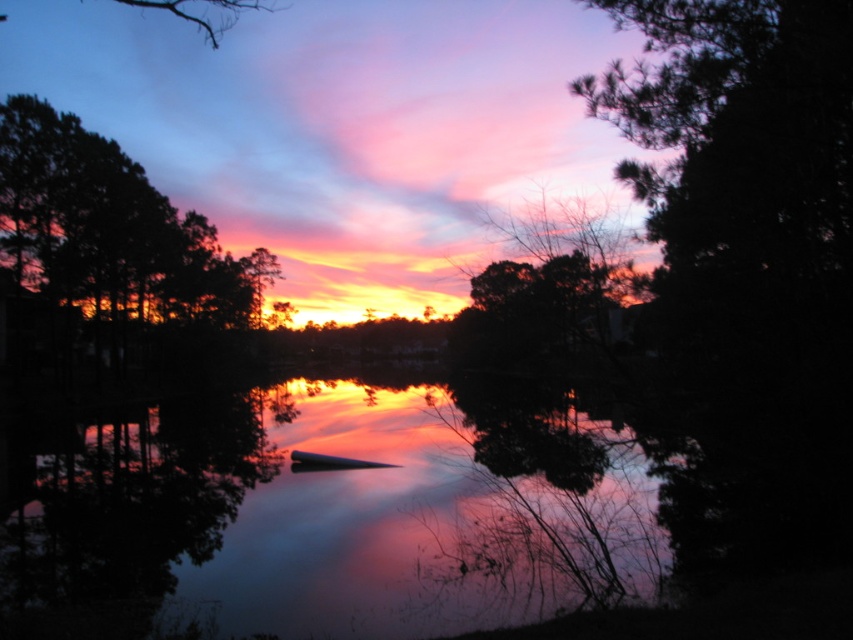
Question: From the image, what is the correct spatial relationship of smooth water at center in relation to silvery metallic tree at upper center?

Choices:
 (A) below
 (B) above

Answer: (A)

Question: Can you confirm if dark green leafy tree at left is positioned below silvery metallic tree at upper center?

Choices:
 (A) yes
 (B) no

Answer: (B)

Question: Which point is closer to the camera?

Choices:
 (A) (543, 349)
 (B) (178, 266)

Answer: (B)

Question: Which is farther from the silvery metallic tree at upper center?

Choices:
 (A) smooth water at center
 (B) dark green leafy tree at left

Answer: (B)

Question: Which point is farther to the camera?

Choices:
 (A) dark green leafy tree at left
 (B) silvery metallic tree at upper center
 (C) smooth water at center

Answer: (A)

Question: Is smooth water at center wider than dark green leafy tree at left?

Choices:
 (A) no
 (B) yes

Answer: (B)